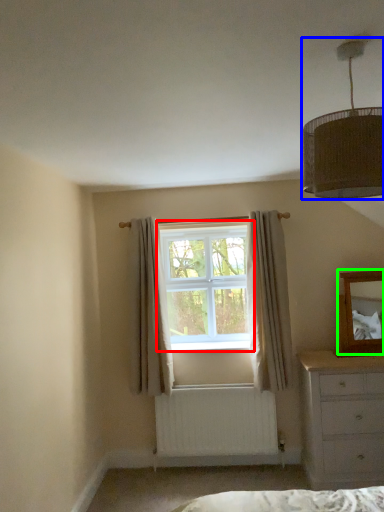
Question: Estimate the real-world distances between objects in this image. Which object is closer to window (highlighted by a red box), lamp (highlighted by a blue box) or mirror (highlighted by a green box)?

Choices:
 (A) lamp
 (B) mirror

Answer: (B)